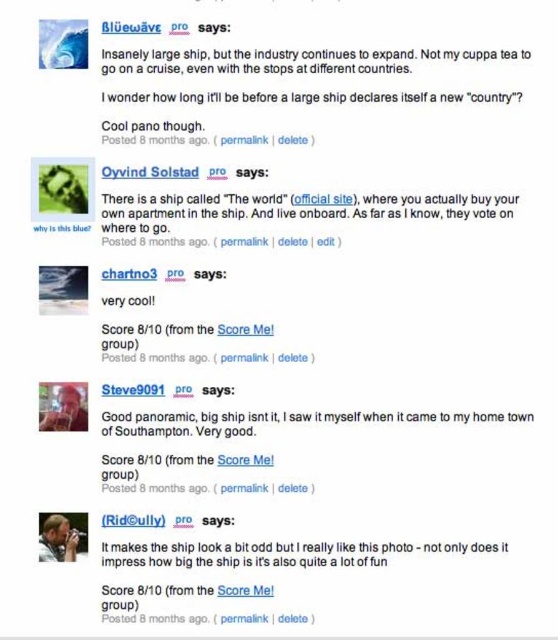
In the comment section, there are two points marked as point 1 at position (282, 243) and point 2 at position (175, 564). From the perspective of the user looking at the screen, which point is closer to the bottom edge of the screen?

Point 2 at position (175, 564) is closer to the bottom edge of the screen because its y coordinate is lower than point 1.

You are a user trying to navigate between two points marked in the comment section. The points are labeled as point [117,218] and point [238,417]. Which point is closer to you?

Point [117,218] is closer to the viewer than point [238,417].

From the picture: Based on the scene described, which object has a smaller width between the white glossy text at center and the good panoramic big ship at center?

The white glossy text at center has a smaller width compared to the good panoramic big ship at center as stated in the objects description.